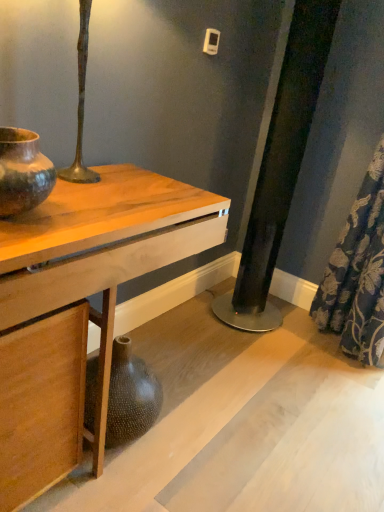
Question: From the image's perspective, is matte brown ceramic vase at left under wooden table at center?

Choices:
 (A) no
 (B) yes

Answer: (A)

Question: Is wooden table at center at the back of matte brown ceramic vase at left?

Choices:
 (A) no
 (B) yes

Answer: (A)

Question: Does matte brown ceramic vase at left have a greater width compared to wooden table at center?

Choices:
 (A) no
 (B) yes

Answer: (A)

Question: Can you confirm if matte brown ceramic vase at left is shorter than wooden table at center?

Choices:
 (A) no
 (B) yes

Answer: (B)

Question: From a real-world perspective, does matte brown ceramic vase at left stand above wooden table at center?

Choices:
 (A) yes
 (B) no

Answer: (A)

Question: Is blue floral fabric at lower right to the left or to the right of matte brown ceramic vase at left in the image?

Choices:
 (A) left
 (B) right

Answer: (B)

Question: From the image's perspective, is blue floral fabric at lower right positioned above or below matte brown ceramic vase at left?

Choices:
 (A) below
 (B) above

Answer: (B)

Question: Considering the positions of point (337, 274) and point (23, 208), is point (337, 274) closer or farther from the camera than point (23, 208)?

Choices:
 (A) farther
 (B) closer

Answer: (A)

Question: Considering the positions of blue floral fabric at lower right and matte brown ceramic vase at left in the image, is blue floral fabric at lower right wider or thinner than matte brown ceramic vase at left?

Choices:
 (A) thin
 (B) wide

Answer: (B)

Question: Do you think wooden table at center is within matte brown ceramic vase at left, or outside of it?

Choices:
 (A) outside
 (B) inside

Answer: (A)

Question: In the image, is wooden table at center positioned in front of or behind matte brown ceramic vase at left?

Choices:
 (A) front
 (B) behind

Answer: (A)

Question: Is wooden table at center wider or thinner than matte brown ceramic vase at left?

Choices:
 (A) thin
 (B) wide

Answer: (B)

Question: In terms of height, does wooden table at center look taller or shorter compared to matte brown ceramic vase at left?

Choices:
 (A) tall
 (B) short

Answer: (A)

Question: Would you say wooden table at center is to the left or to the right of blue floral fabric at lower right in the picture?

Choices:
 (A) left
 (B) right

Answer: (A)

Question: Looking at their shapes, would you say wooden table at center is wider or thinner than blue floral fabric at lower right?

Choices:
 (A) wide
 (B) thin

Answer: (A)